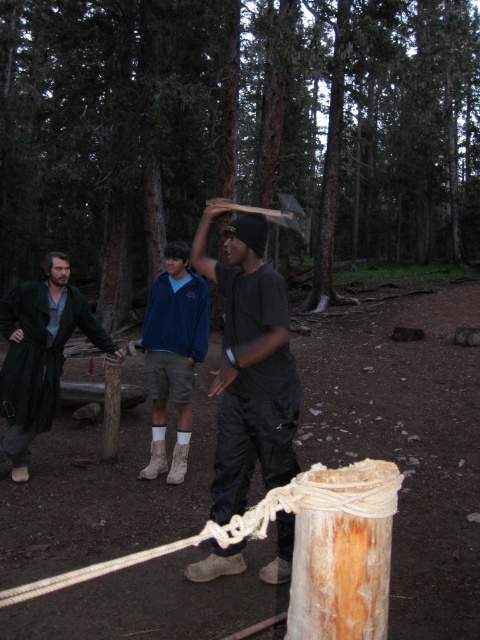
You are a hiker who needs to secure your gear to the brown wood post at center. The white rope at center is available. Can you determine if the rope is wide enough to wrap around the post?

The brown wood post at center might be wider than white rope at center, so the white rope at center may not be wide enough to securely wrap around the post. Consider using a thicker rope or alternative securing method.